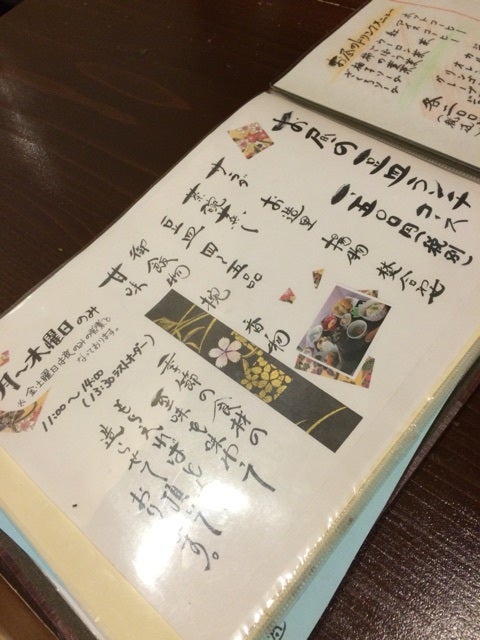
Find the location of a particular element. Image resolution: width=480 pixels, height=640 pixels. wood grain is located at coordinates (416, 545), (377, 576).